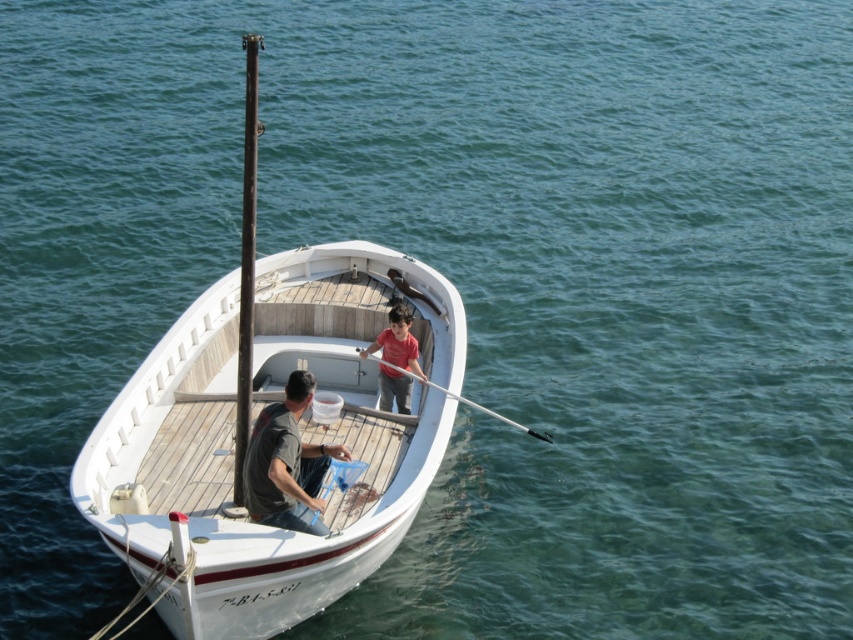
Question: Among these objects, which one is farthest from the camera?

Choices:
 (A) smooth white pole at center
 (B) dark brown wooden pole at center

Answer: (A)

Question: Can you confirm if white wooden boat at center is positioned to the left of smooth white pole at center?

Choices:
 (A) no
 (B) yes

Answer: (B)

Question: Is matte red shirt at center smaller than smooth white pole at center?

Choices:
 (A) no
 (B) yes

Answer: (B)

Question: Among these points, which one is nearest to the camera?

Choices:
 (A) (242, 228)
 (B) (221, 566)

Answer: (B)

Question: Can you confirm if dark gray fabric shirt at center is positioned below smooth white pole at center?

Choices:
 (A) yes
 (B) no

Answer: (A)

Question: Based on their relative distances, which object is farther from the dark gray fabric shirt at center?

Choices:
 (A) matte red shirt at center
 (B) white wooden boat at center
 (C) dark brown wooden pole at center

Answer: (A)